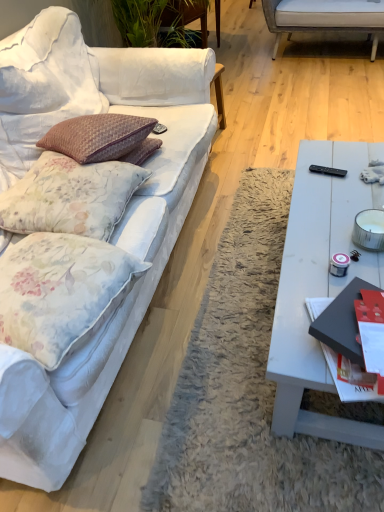
I want to click on free space to the left of black plastic remote control at right, so click(303, 180).